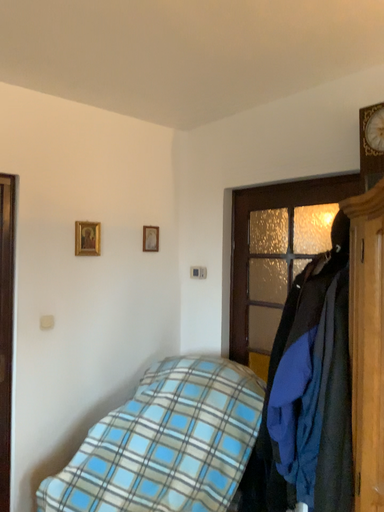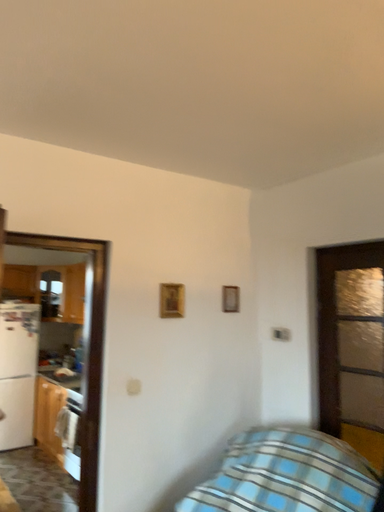
Question: Which way did the camera rotate in the video?

Choices:
 (A) rotated left
 (B) rotated right

Answer: (A)